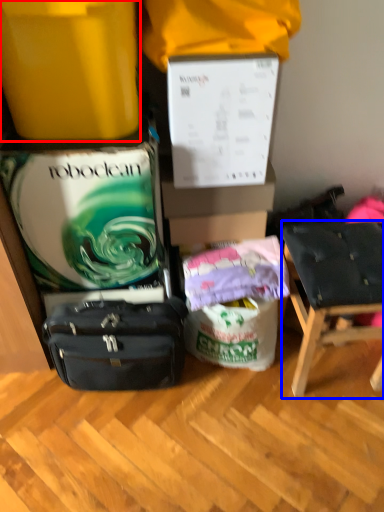
Question: Which object appears closest to the camera in this image, box (highlighted by a red box) or chair (highlighted by a blue box)?

Choices:
 (A) box
 (B) chair

Answer: (A)